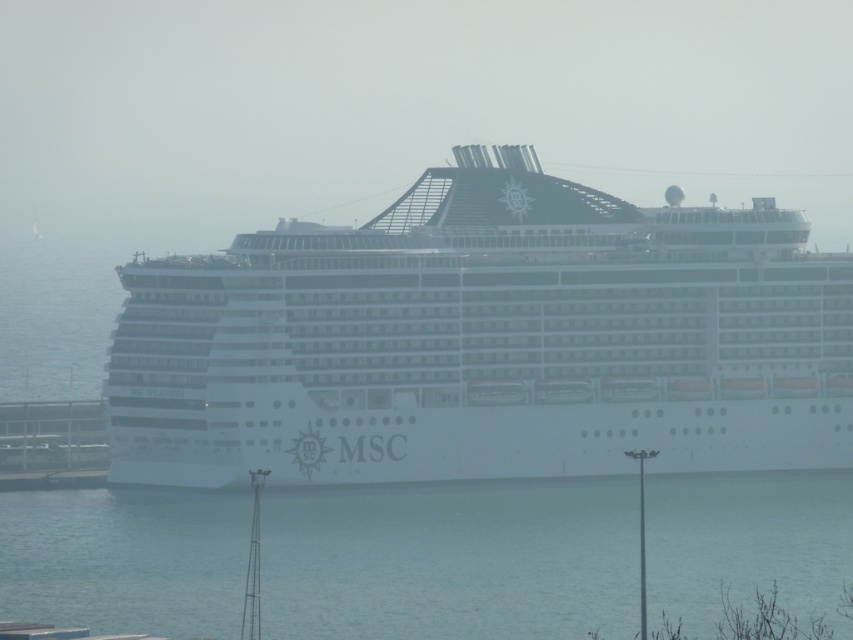
Question: Among these points, which one is nearest to the camera?

Choices:
 (A) (236, 538)
 (B) (141, 392)

Answer: (B)

Question: From the image, what is the correct spatial relationship of white matte cruise ship at center in relation to clear blue water at lower center?

Choices:
 (A) below
 (B) above

Answer: (B)

Question: Can you confirm if white matte cruise ship at center is positioned below clear blue water at lower center?

Choices:
 (A) yes
 (B) no

Answer: (B)

Question: Which object is farther from the camera taking this photo?

Choices:
 (A) clear blue water at lower center
 (B) white matte cruise ship at center

Answer: (B)

Question: Does white matte cruise ship at center appear on the right side of clear blue water at lower center?

Choices:
 (A) no
 (B) yes

Answer: (B)